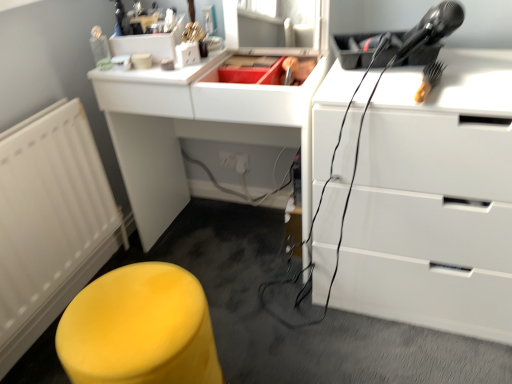
Question: Considering the relative sizes of white matte radiator at left and white glossy computer desk at center in the image provided, is white matte radiator at left smaller than white glossy computer desk at center?

Choices:
 (A) no
 (B) yes

Answer: (B)

Question: Does white matte radiator at left appear on the left side of white glossy computer desk at center?

Choices:
 (A) yes
 (B) no

Answer: (A)

Question: Is white matte radiator at left wider than white glossy computer desk at center?

Choices:
 (A) yes
 (B) no

Answer: (B)

Question: Does white matte radiator at left have a larger size compared to white glossy computer desk at center?

Choices:
 (A) yes
 (B) no

Answer: (B)

Question: From a real-world perspective, is white matte radiator at left on top of white glossy computer desk at center?

Choices:
 (A) yes
 (B) no

Answer: (B)

Question: Is white matte radiator at left not near white glossy computer desk at center?

Choices:
 (A) no
 (B) yes

Answer: (A)

Question: Is yellow plastic brush at upper right surrounding white matte radiator at left?

Choices:
 (A) yes
 (B) no

Answer: (B)

Question: Does yellow plastic brush at upper right have a lesser width compared to white matte radiator at left?

Choices:
 (A) yes
 (B) no

Answer: (B)

Question: From a real-world perspective, is yellow plastic brush at upper right positioned under white matte radiator at left based on gravity?

Choices:
 (A) no
 (B) yes

Answer: (A)

Question: Is yellow plastic brush at upper right closer to the viewer compared to white matte radiator at left?

Choices:
 (A) no
 (B) yes

Answer: (A)

Question: Is yellow plastic brush at upper right shorter than white matte radiator at left?

Choices:
 (A) no
 (B) yes

Answer: (B)

Question: Could you tell me if yellow plastic brush at upper right is facing white matte radiator at left?

Choices:
 (A) no
 (B) yes

Answer: (A)

Question: Would you say white matte radiator at left is a long distance from yellow plastic brush at upper right?

Choices:
 (A) no
 (B) yes

Answer: (B)